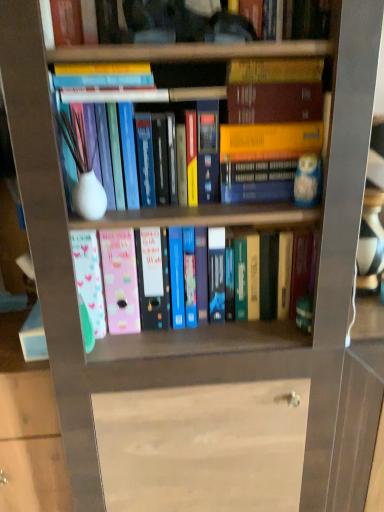
Question: Does matte white vase at center, the third book when ordered from top to bottom, have a greater width compared to pastel plastic folders at center, which is the 1th book in bottom-to-top order?

Choices:
 (A) yes
 (B) no

Answer: (B)

Question: Is matte white vase at center, the 2th book positioned from the bottom, smaller than pastel plastic folders at center, which is the 1th book in bottom-to-top order?

Choices:
 (A) no
 (B) yes

Answer: (B)

Question: Is the position of matte white vase at center, the 2th book positioned from the bottom, more distant than that of pastel plastic folders at center, the fourth book in the top-to-bottom sequence?

Choices:
 (A) yes
 (B) no

Answer: (B)

Question: From a real-world perspective, is matte white vase at center, the 2th book positioned from the bottom, beneath pastel plastic folders at center, which is the 1th book in bottom-to-top order?

Choices:
 (A) no
 (B) yes

Answer: (A)

Question: Does matte white vase at center, the 2th book positioned from the bottom, appear on the left side of pastel plastic folders at center, which is the 1th book in bottom-to-top order?

Choices:
 (A) no
 (B) yes

Answer: (A)

Question: Based on their sizes in the image, would you say pastel plastic folders at center, which is the 1th book in bottom-to-top order, is bigger or smaller than hardcover book at upper center, marked as the second book in a top-to-bottom arrangement?

Choices:
 (A) small
 (B) big

Answer: (B)

Question: From a real-world perspective, relative to hardcover book at upper center, marked as the second book in a top-to-bottom arrangement, is pastel plastic folders at center, the fourth book in the top-to-bottom sequence, vertically above or below?

Choices:
 (A) above
 (B) below

Answer: (B)

Question: Does point (292, 293) appear closer or farther from the camera than point (74, 87)?

Choices:
 (A) closer
 (B) farther

Answer: (B)

Question: Would you say pastel plastic folders at center, which is the 1th book in bottom-to-top order, is inside or outside hardcover book at upper center, arranged as the 3th book when ordered from the bottom?

Choices:
 (A) inside
 (B) outside

Answer: (B)

Question: Is point (203, 193) positioned closer to the camera than point (74, 10)?

Choices:
 (A) farther
 (B) closer

Answer: (A)

Question: Based on their sizes in the image, would you say matte white vase at center, the third book when ordered from top to bottom, is bigger or smaller than hardcover book at upper center, which is counted as the 4th book, starting from the bottom?

Choices:
 (A) small
 (B) big

Answer: (B)

Question: From a real-world perspective, is matte white vase at center, the third book when ordered from top to bottom, physically located above or below hardcover book at upper center, placed as the first book when sorted from top to bottom?

Choices:
 (A) below
 (B) above

Answer: (A)

Question: From the image's perspective, is matte white vase at center, the third book when ordered from top to bottom, located above or below hardcover book at upper center, placed as the first book when sorted from top to bottom?

Choices:
 (A) above
 (B) below

Answer: (B)

Question: In terms of height, does hardcover book at upper center, arranged as the 3th book when ordered from the bottom, look taller or shorter compared to hardcover book at upper center, placed as the first book when sorted from top to bottom?

Choices:
 (A) short
 (B) tall

Answer: (A)

Question: Visually, is hardcover book at upper center, marked as the second book in a top-to-bottom arrangement, positioned to the left or to the right of hardcover book at upper center, placed as the first book when sorted from top to bottom?

Choices:
 (A) right
 (B) left

Answer: (B)